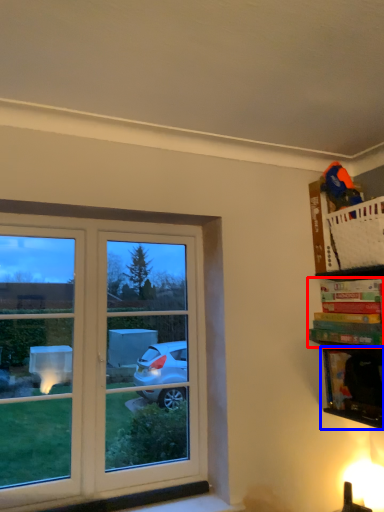
Question: Which point is further to the camera, book (highlighted by a red box) or cabinet (highlighted by a blue box)?

Choices:
 (A) book
 (B) cabinet

Answer: (B)